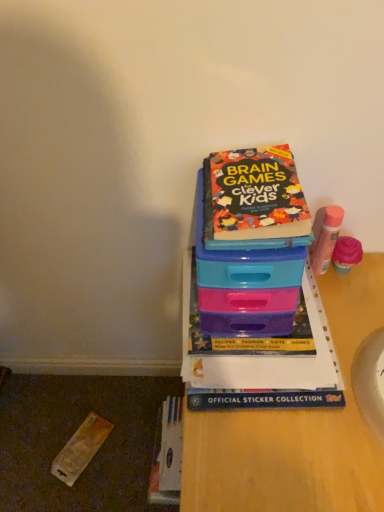
Question: From a real-world perspective, is multicolored paper book at upper center, the second book ordered from the bottom, positioned over hardcover book at center, arranged as the 1th book when ordered from the bottom, based on gravity?

Choices:
 (A) no
 (B) yes

Answer: (B)

Question: Can hardcover book at center, arranged as the 1th book when ordered from the bottom, be found inside multicolored paper book at upper center, the 1th book when ordered from top to bottom?

Choices:
 (A) yes
 (B) no

Answer: (B)

Question: Considering the relative positions of multicolored paper book at upper center, the second book ordered from the bottom, and hardcover book at center, arranged as the 2th book when viewed from the top, in the image provided, is multicolored paper book at upper center, the second book ordered from the bottom, to the right of hardcover book at center, arranged as the 2th book when viewed from the top, from the viewer's perspective?

Choices:
 (A) yes
 (B) no

Answer: (B)

Question: Is multicolored paper book at upper center, the 1th book when ordered from top to bottom, further to camera compared to hardcover book at center, arranged as the 1th book when ordered from the bottom?

Choices:
 (A) no
 (B) yes

Answer: (A)

Question: Considering the relative sizes of multicolored paper book at upper center, the second book ordered from the bottom, and hardcover book at center, arranged as the 1th book when ordered from the bottom, in the image provided, is multicolored paper book at upper center, the second book ordered from the bottom, thinner than hardcover book at center, arranged as the 1th book when ordered from the bottom,?

Choices:
 (A) yes
 (B) no

Answer: (A)

Question: Considering the relative positions of multicolored paper book at upper center, the second book ordered from the bottom, and hardcover book at center, arranged as the 2th book when viewed from the top, in the image provided, is multicolored paper book at upper center, the second book ordered from the bottom, to the left or to the right of hardcover book at center, arranged as the 2th book when viewed from the top,?

Choices:
 (A) right
 (B) left

Answer: (B)

Question: Based on their sizes in the image, would you say multicolored paper book at upper center, the 1th book when ordered from top to bottom, is bigger or smaller than hardcover book at center, arranged as the 2th book when viewed from the top?

Choices:
 (A) small
 (B) big

Answer: (A)

Question: Do you think multicolored paper book at upper center, the second book ordered from the bottom, is within hardcover book at center, arranged as the 1th book when ordered from the bottom, or outside of it?

Choices:
 (A) inside
 (B) outside

Answer: (B)

Question: Considering the positions of multicolored paper book at upper center, the second book ordered from the bottom, and hardcover book at center, arranged as the 2th book when viewed from the top, in the image, is multicolored paper book at upper center, the second book ordered from the bottom, wider or thinner than hardcover book at center, arranged as the 2th book when viewed from the top,?

Choices:
 (A) thin
 (B) wide

Answer: (A)

Question: In terms of width, does plastic at center look wider or thinner when compared to hardcover book at center, arranged as the 2th book when viewed from the top?

Choices:
 (A) wide
 (B) thin

Answer: (A)

Question: Do you think plastic at center is within hardcover book at center, arranged as the 1th book when ordered from the bottom, or outside of it?

Choices:
 (A) outside
 (B) inside

Answer: (A)

Question: Considering the relative positions of plastic at center and hardcover book at center, arranged as the 2th book when viewed from the top, in the image provided, is plastic at center to the left or to the right of hardcover book at center, arranged as the 2th book when viewed from the top,?

Choices:
 (A) right
 (B) left

Answer: (A)

Question: Is plastic at center bigger or smaller than hardcover book at center, arranged as the 1th book when ordered from the bottom?

Choices:
 (A) small
 (B) big

Answer: (B)

Question: Based on their positions, is hardcover book at center, arranged as the 2th book when viewed from the top, located to the left or right of multicolored paper book at upper center, the 1th book when ordered from top to bottom?

Choices:
 (A) right
 (B) left

Answer: (A)

Question: Based on their sizes in the image, would you say hardcover book at center, arranged as the 2th book when viewed from the top, is bigger or smaller than multicolored paper book at upper center, the 1th book when ordered from top to bottom?

Choices:
 (A) big
 (B) small

Answer: (A)